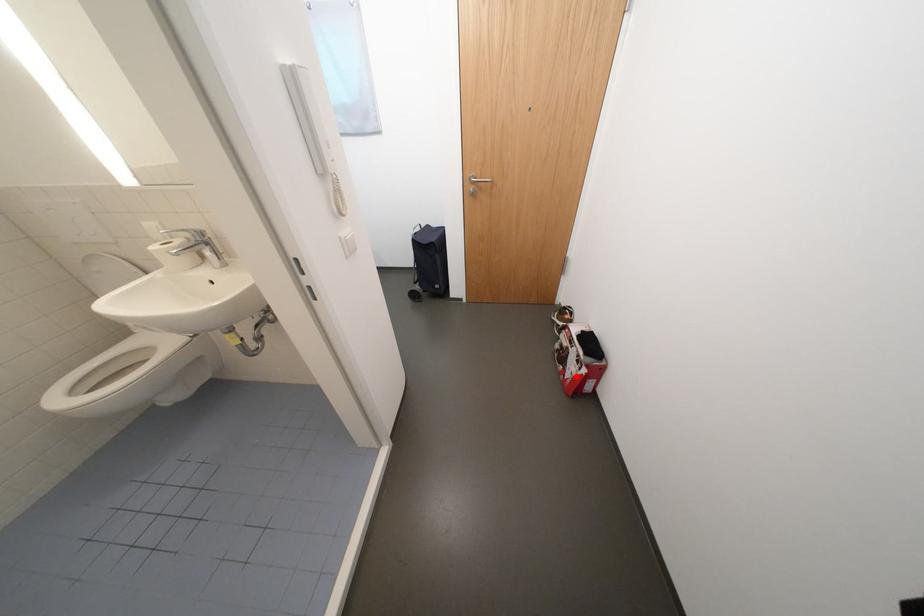
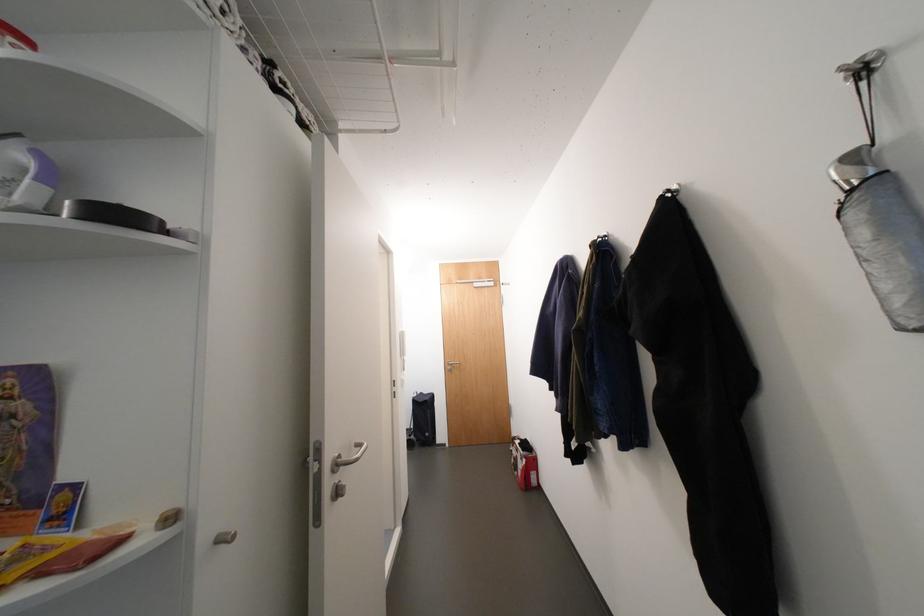
Question: A red point is marked in image1. In image2, is the corresponding 3D point closer to the camera or farther? Reply with the corresponding letter.

Choices:
 (A) The corresponding 3D point is closer.
 (B) The corresponding 3D point is farther.

Answer: (B)